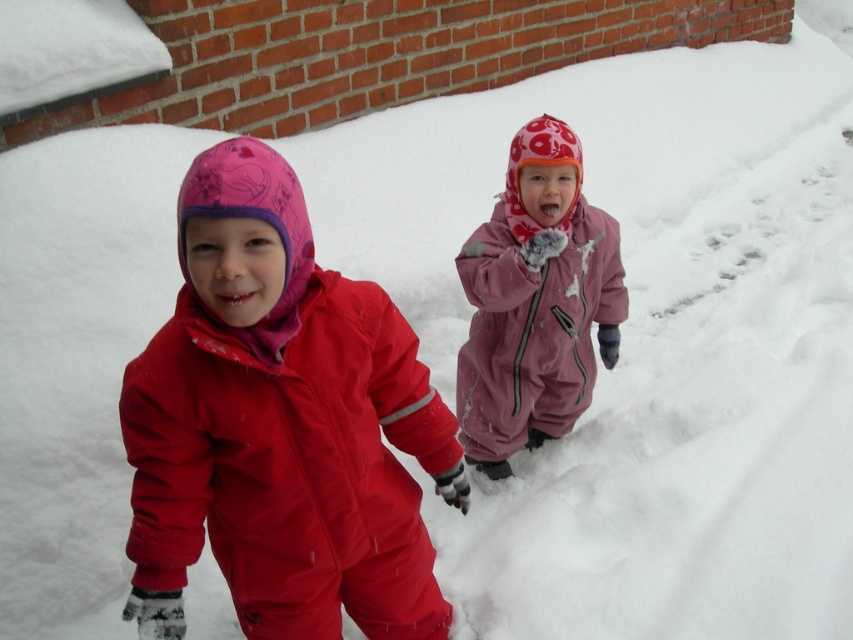
Which is behind, point (376, 426) or point (579, 157)?

Point (579, 157)

What do you see at coordinates (281, 428) in the screenshot? The width and height of the screenshot is (853, 640). I see `matte red snowsuit at left` at bounding box center [281, 428].

The image size is (853, 640). Identify the location of matte red snowsuit at left. (281, 428).